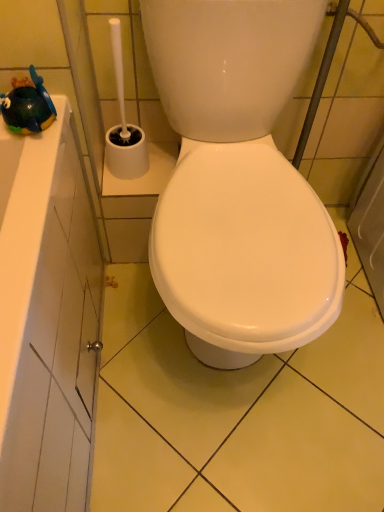
Measure the distance between shiny plastic toy at upper left and camera.

shiny plastic toy at upper left is 29.01 inches from camera.

Describe the element at coordinates (28, 106) in the screenshot. I see `shiny plastic toy at upper left` at that location.

In order to face shiny plastic toy at upper left, should I rotate leftwards or rightwards?

It's best to rotate left around 21.768 degrees.

What is the approximate width of shiny plastic toy at upper left?

shiny plastic toy at upper left is 4.01 inches in width.

What are the coordinates of `shiny plastic toy at upper left` in the screenshot? It's located at (28, 106).

You are a GUI agent. You are given a task and a screenshot of the screen. Output one action in this format:
    pyautogui.click(x=<x>, y=<y>)
    Task: Click on the shiny plastic toy at upper left
    The height and width of the screenshot is (512, 384).
    Given the screenshot: What is the action you would take?
    pyautogui.click(x=28, y=106)